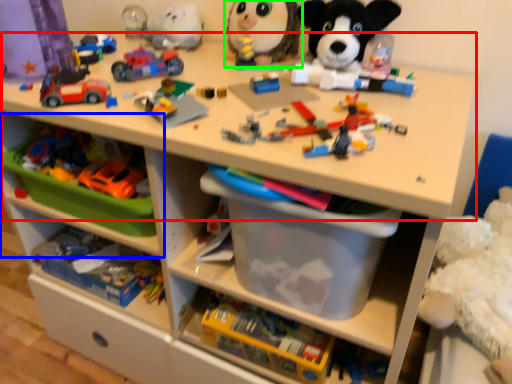
Question: Which is farther away from changing table (highlighted by a red box)? shelf (highlighted by a blue box) or toy (highlighted by a green box)?

Choices:
 (A) shelf
 (B) toy

Answer: (A)